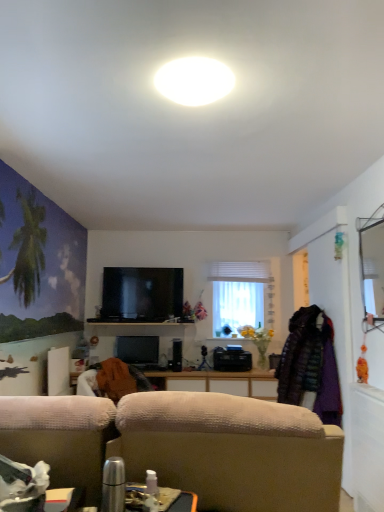
Question: From the image's perspective, would you say black glossy flat-screen tv at center, the first television viewed from the top, is shown under white glossy ceiling light at upper center?

Choices:
 (A) yes
 (B) no

Answer: (A)

Question: Is black glossy flat-screen tv at center, the first television viewed from the top, at the left side of white glossy ceiling light at upper center?

Choices:
 (A) no
 (B) yes

Answer: (B)

Question: Is black glossy flat-screen tv at center, which appears as the second television when ordered from the bottom, looking in the opposite direction of white glossy ceiling light at upper center?

Choices:
 (A) yes
 (B) no

Answer: (B)

Question: From the image's perspective, would you say black glossy flat-screen tv at center, the first television viewed from the top, is positioned over white glossy ceiling light at upper center?

Choices:
 (A) no
 (B) yes

Answer: (A)

Question: Are black glossy flat-screen tv at center, which appears as the second television when ordered from the bottom, and white glossy ceiling light at upper center making contact?

Choices:
 (A) yes
 (B) no

Answer: (B)

Question: In terms of height, does white glossy ceiling light at upper center look taller or shorter compared to black glossy flat-screen tv at center, which appears as the second television when ordered from the bottom?

Choices:
 (A) tall
 (B) short

Answer: (B)

Question: Is white glossy ceiling light at upper center bigger or smaller than black glossy flat-screen tv at center, the first television viewed from the top?

Choices:
 (A) small
 (B) big

Answer: (A)

Question: Is white glossy ceiling light at upper center in front of or behind black glossy flat-screen tv at center, which appears as the second television when ordered from the bottom, in the image?

Choices:
 (A) front
 (B) behind

Answer: (A)

Question: In terms of width, does white glossy ceiling light at upper center look wider or thinner when compared to black glossy flat-screen tv at center, the first television viewed from the top?

Choices:
 (A) thin
 (B) wide

Answer: (B)

Question: Considering the positions of black glossy flat-screen tv at center, the first television viewed from the top, and black glossy television at center, which is counted as the first television, starting from the bottom, in the image, is black glossy flat-screen tv at center, the first television viewed from the top, wider or thinner than black glossy television at center, which is counted as the first television, starting from the bottom,?

Choices:
 (A) thin
 (B) wide

Answer: (B)

Question: In the image, is black glossy flat-screen tv at center, the first television viewed from the top, positioned in front of or behind black glossy television at center, which is counted as the first television, starting from the bottom?

Choices:
 (A) front
 (B) behind

Answer: (B)

Question: Is point (125, 305) closer or farther from the camera than point (147, 357)?

Choices:
 (A) closer
 (B) farther

Answer: (B)

Question: Based on their positions, is black glossy flat-screen tv at center, the first television viewed from the top, located to the left or right of black glossy television at center, the second television positioned from the top?

Choices:
 (A) right
 (B) left

Answer: (A)

Question: Considering the positions of white sheer curtain at center and white glossy ceiling light at upper center in the image, is white sheer curtain at center bigger or smaller than white glossy ceiling light at upper center?

Choices:
 (A) big
 (B) small

Answer: (A)

Question: From a real-world perspective, relative to white glossy ceiling light at upper center, is white sheer curtain at center vertically above or below?

Choices:
 (A) above
 (B) below

Answer: (B)